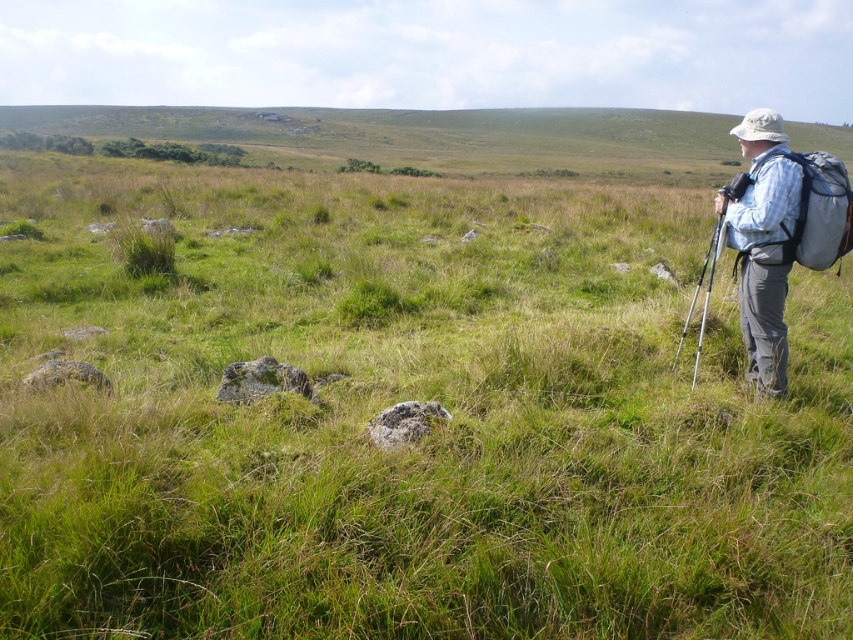
Question: Which point is farther to the camera?

Choices:
 (A) blue plaid shirt at right
 (B) gray fabric backpack at right

Answer: (A)

Question: Can you confirm if blue plaid shirt at right is bigger than gray fabric backpack at right?

Choices:
 (A) yes
 (B) no

Answer: (A)

Question: Does blue plaid shirt at right lie in front of gray fabric backpack at right?

Choices:
 (A) yes
 (B) no

Answer: (B)

Question: Is blue plaid shirt at right closer to camera compared to gray fabric backpack at right?

Choices:
 (A) no
 (B) yes

Answer: (A)